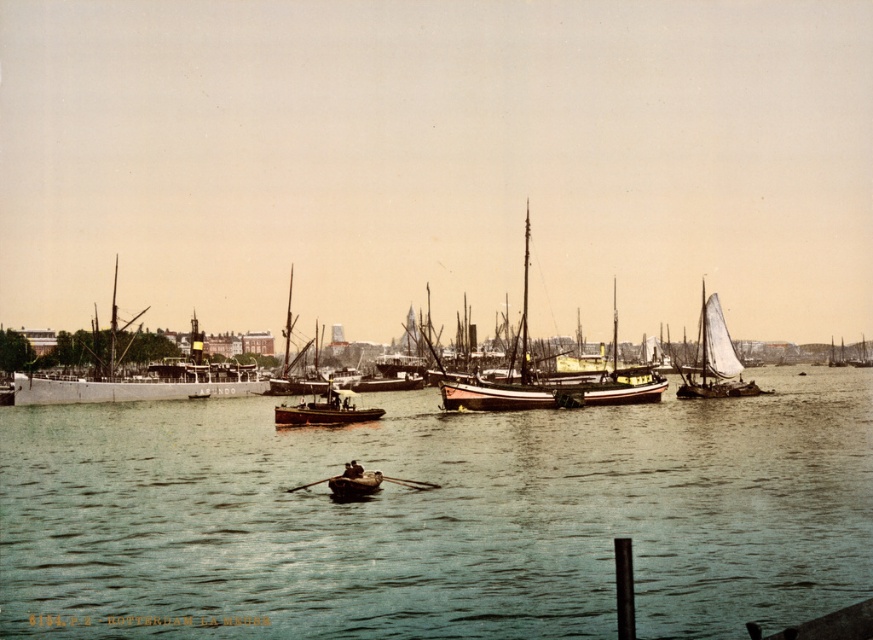
Does wooden sailboat at center have a lesser width compared to wooden boat at center?

In fact, wooden sailboat at center might be wider than wooden boat at center.

Between wooden sailboat at center and wooden boat at center, which one appears on the right side from the viewer's perspective?

From the viewer's perspective, wooden sailboat at center appears more on the right side.

Describe the element at coordinates (553, 378) in the screenshot. The image size is (873, 640). I see `wooden sailboat at center` at that location.

Locate an element on the screen. This screenshot has height=640, width=873. wooden sailboat at center is located at coordinates (553, 378).

Which is in front, point (29, 385) or point (519, 330)?

Point (519, 330)

Which is above, white wooden ship at left or wooden sailboat at center?

Positioned higher is wooden sailboat at center.

Is point (174, 376) closer to camera compared to point (523, 344)?

No, it is behind (523, 344).

Where is `white wooden ship at left`? The width and height of the screenshot is (873, 640). white wooden ship at left is located at coordinates (142, 384).

Based on the photo, can you confirm if wooden boat at center is bigger than wooden rowboat at center?

Yes, wooden boat at center is bigger than wooden rowboat at center.

Who is more distant from viewer, (x=327, y=408) or (x=377, y=474)?

Positioned behind is point (x=327, y=408).

What do you see at coordinates (327, 410) in the screenshot?
I see `wooden boat at center` at bounding box center [327, 410].

Where is `wooden boat at center`? Image resolution: width=873 pixels, height=640 pixels. wooden boat at center is located at coordinates (327, 410).